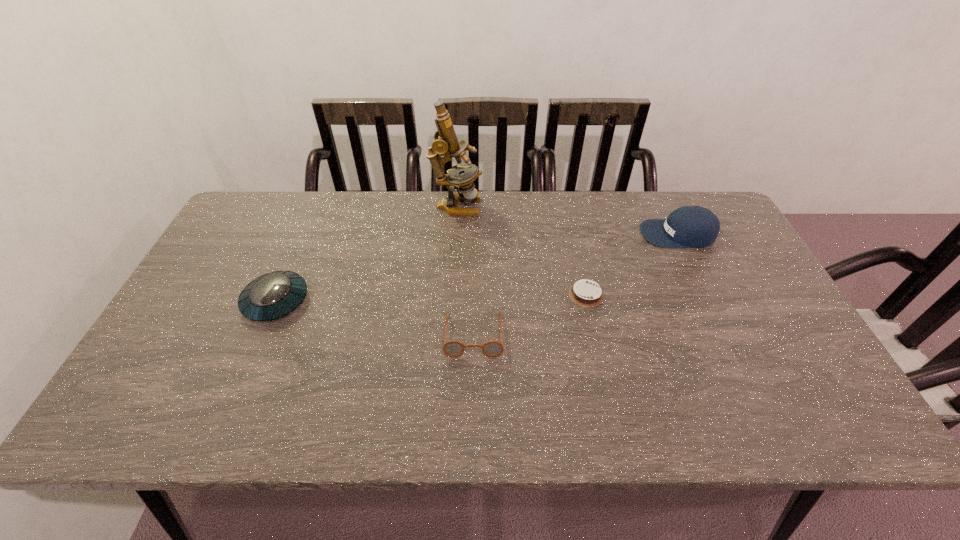
The height and width of the screenshot is (540, 960). Find the location of `the farthest object`. the farthest object is located at coordinates (446, 142).

The height and width of the screenshot is (540, 960). In order to click on the tallest object in this screenshot , I will do `click(446, 142)`.

Locate an element on the screen. This screenshot has width=960, height=540. baseball cap is located at coordinates (689, 226).

Find the location of a particular element. the second tallest object is located at coordinates (689, 226).

Locate an element on the screen. saucer is located at coordinates (273, 295).

Locate an element on the screen. spectacles is located at coordinates click(453, 348).

Where is `the second object from right to left`? The image size is (960, 540). the second object from right to left is located at coordinates (586, 293).

This screenshot has height=540, width=960. In order to click on chocolate cake in this screenshot , I will do `click(586, 293)`.

I want to click on free space located on the right of the farthest object, so click(578, 206).

You are a GUI agent. You are given a task and a screenshot of the screen. Output one action in this format:
    pyautogui.click(x=<x>, y=<y>)
    Task: Click on the free space located on the front-facing side of the baseball cap
    
    Given the screenshot: What is the action you would take?
    pyautogui.click(x=602, y=234)